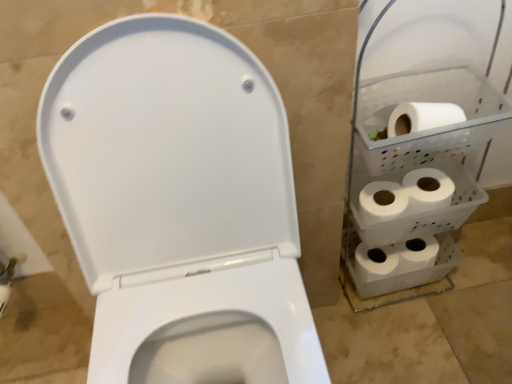
Where is `free spot in front of white matte toilet paper at lower right, which is the 3th toilet paper from right to left`? free spot in front of white matte toilet paper at lower right, which is the 3th toilet paper from right to left is located at coordinates (393, 339).